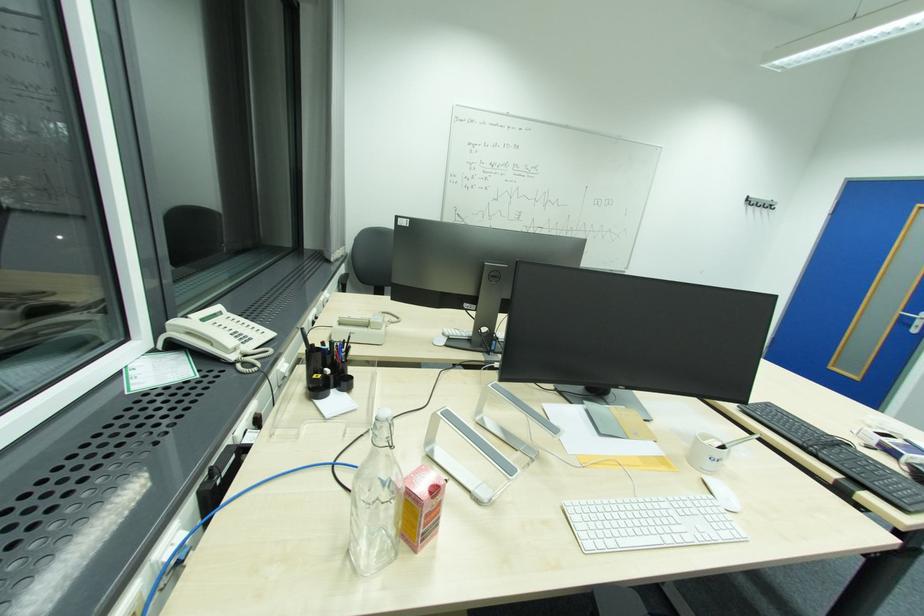
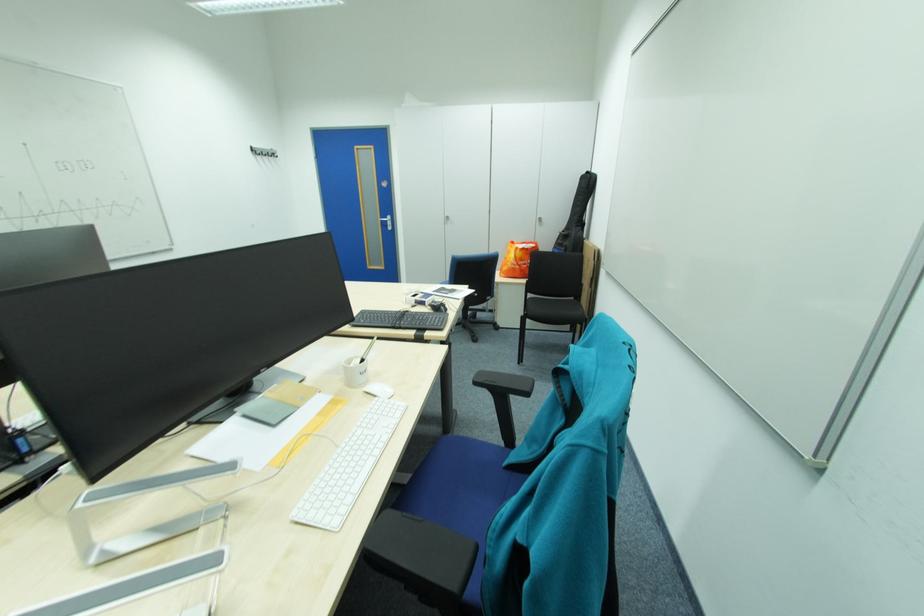
How did the camera likely rotate?

The camera's rotation is toward right-down.